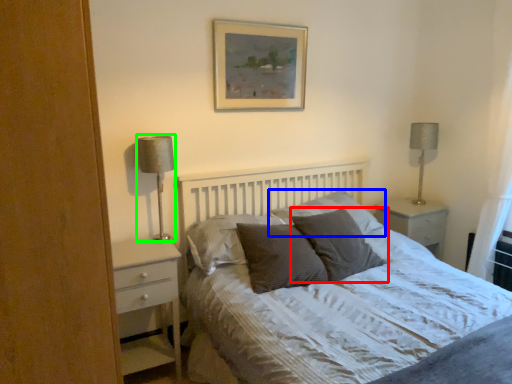
Question: Estimate the real-world distances between objects in this image. Which object is farther from pillow (highlighted by a red box), pillow (highlighted by a blue box) or table lamp (highlighted by a green box)?

Choices:
 (A) pillow
 (B) table lamp

Answer: (B)